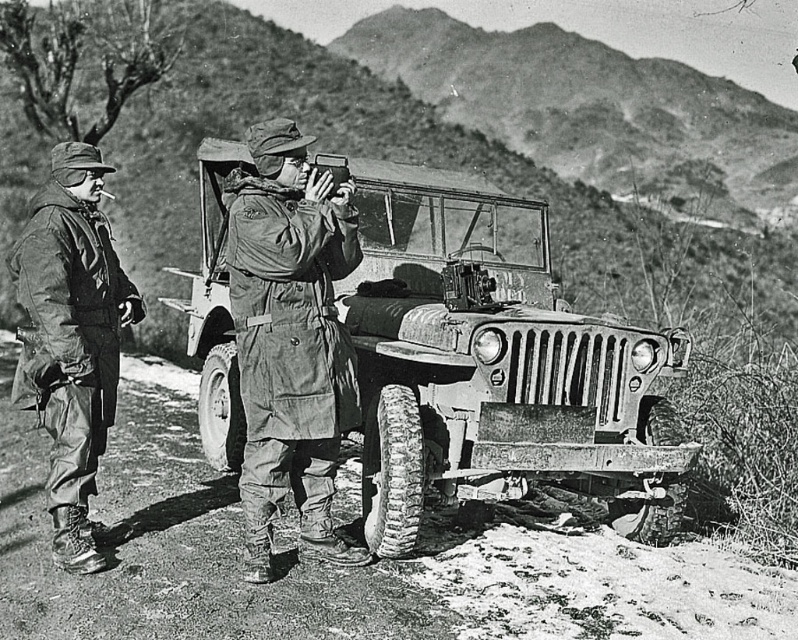
Who is lower down, rusty metal jeep at center or dull olive-green fabric at center?

dull olive-green fabric at center is lower down.

Can you confirm if rusty metal jeep at center is positioned above dull olive-green fabric at center?

Yes, rusty metal jeep at center is above dull olive-green fabric at center.

Is point (405, 448) positioned in front of point (259, 540)?

No.

The image size is (798, 640). Find the location of `rusty metal jeep at center`. rusty metal jeep at center is located at coordinates (496, 365).

Can you confirm if dull olive-green fabric at center is positioned above brushed metal jacket at left?

Actually, dull olive-green fabric at center is below brushed metal jacket at left.

Consider the image. Who is more distant from viewer, (x=322, y=529) or (x=70, y=147)?

The point (x=322, y=529) is behind.

The width and height of the screenshot is (798, 640). What are the coordinates of `dull olive-green fabric at center` in the screenshot? It's located at (290, 342).

Locate an element on the screen. This screenshot has height=640, width=798. dull olive-green fabric at center is located at coordinates (290, 342).

Is point (346, 372) behind point (322, 164)?

No, it is in front of (322, 164).

Identify the location of dull olive-green fabric at center. Image resolution: width=798 pixels, height=640 pixels. (290, 342).